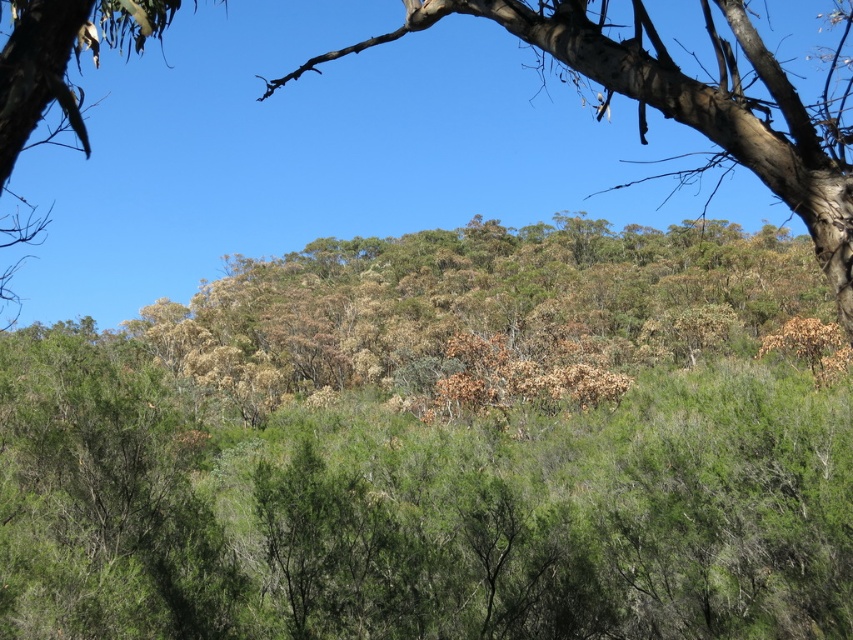
Which is in front, point (341, 340) or point (462, 8)?

Positioned in front is point (462, 8).

What are the coordinates of `brown/dried leaves at center` in the screenshot? It's located at (479, 307).